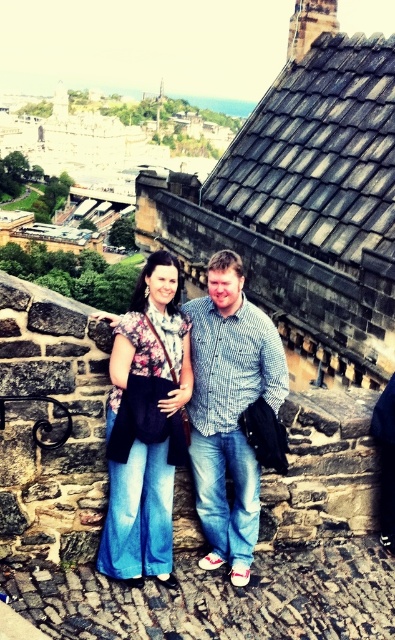
You are a photographer standing at the base of the historic stone structure. You want to capture both the gray slate roof at upper center and the checkered fabric shirt at center in your photo. Which object should you focus on first to ensure both are in frame?

You should focus on the gray slate roof at upper center first because it is much taller than the checkered fabric shirt at center, so adjusting the camera angle to include its height will naturally include the shirt in the foreground.